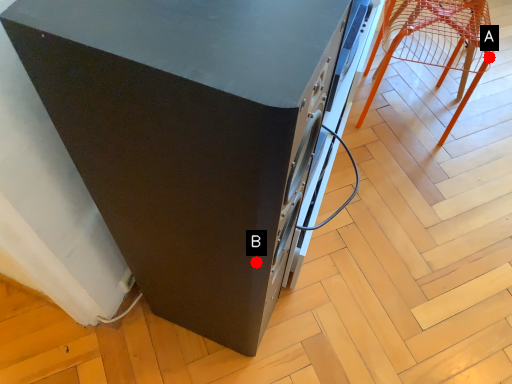
Question: Two points are circled on the image, labeled by A and B beside each circle. Which point is farther to the camera?

Choices:
 (A) A is further
 (B) B is further

Answer: (A)